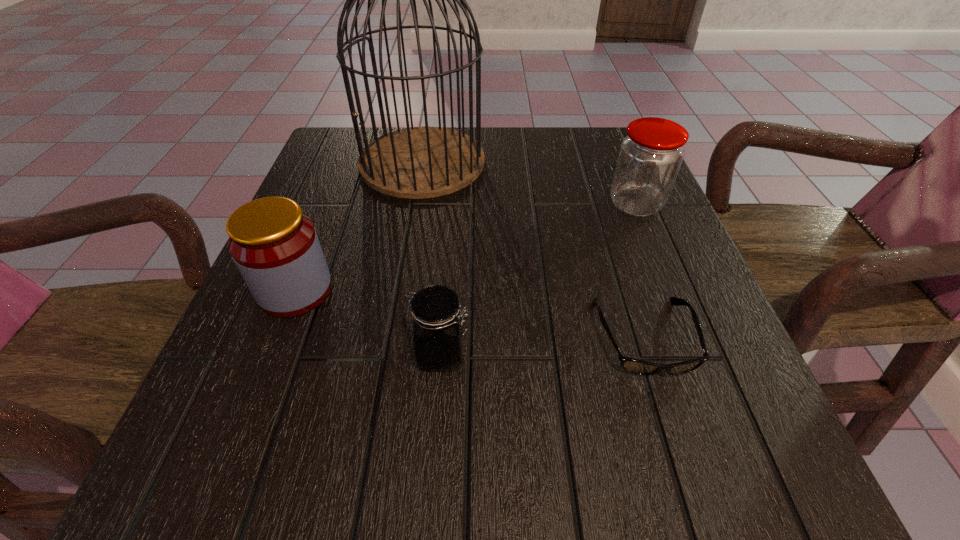
Where is `vacant space that satisfies the following two spatial constraints: 1. on the front-facing side of the shortest object; 2. on the lid of the nearest jar`? The height and width of the screenshot is (540, 960). vacant space that satisfies the following two spatial constraints: 1. on the front-facing side of the shortest object; 2. on the lid of the nearest jar is located at coordinates (650, 355).